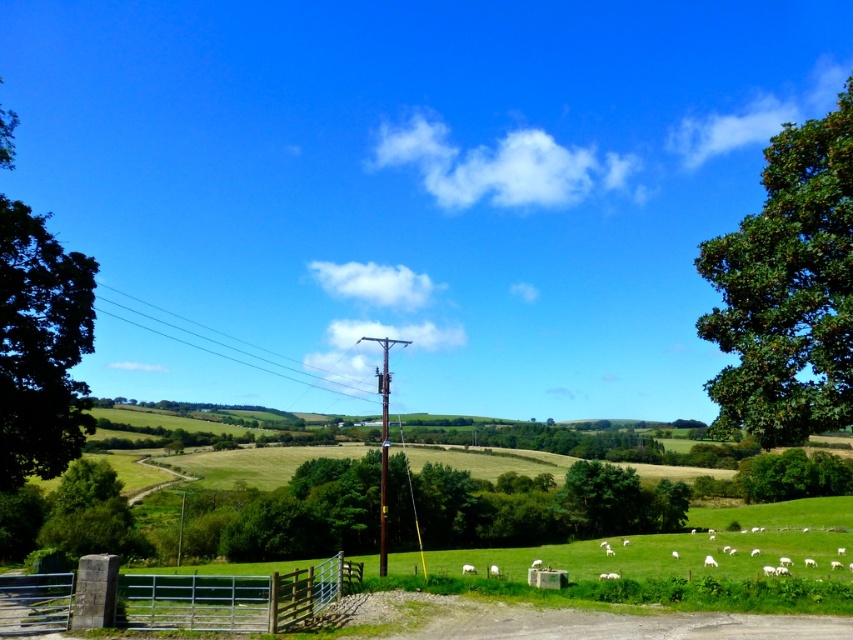
Question: Which object appears farthest from the camera in this image?

Choices:
 (A) green leafy tree at right
 (B) green leafy tree at left
 (C) green leafy tree at lower left
 (D) green leafy tree at lower right

Answer: (D)

Question: Estimate the real-world distances between objects in this image. Which object is closer to the green leafy tree at lower right?

Choices:
 (A) green leafy tree at lower left
 (B) green leafy tree at left
 (C) metallic silver gate at lower center

Answer: (A)

Question: Is metallic silver gate at lower center bigger than green leafy tree at lower left?

Choices:
 (A) no
 (B) yes

Answer: (A)

Question: Can you confirm if green leafy tree at left is smaller than green leafy tree at lower right?

Choices:
 (A) no
 (B) yes

Answer: (B)

Question: Among these points, which one is nearest to the camera?

Choices:
 (A) (39, 387)
 (B) (57, 493)

Answer: (A)

Question: Is green leafy tree at right smaller than metallic silver gate at lower center?

Choices:
 (A) yes
 (B) no

Answer: (A)